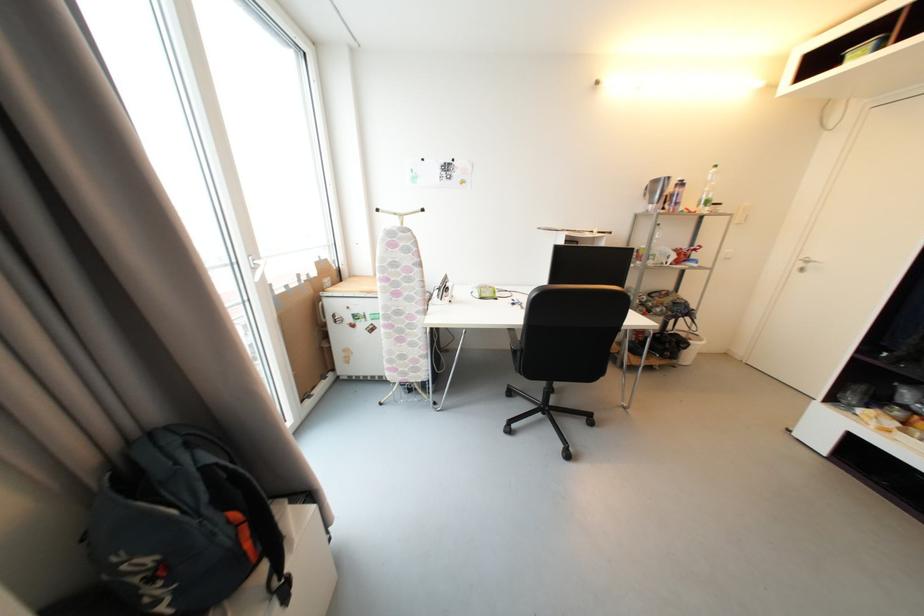
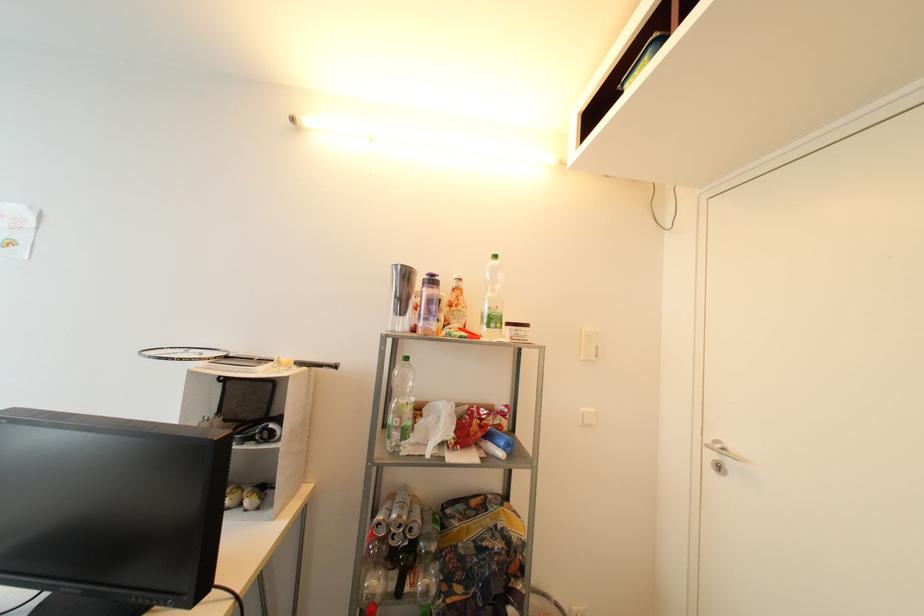
Locate, in the second image, the point that corresponds to point (687, 185) in the first image.

(438, 283)